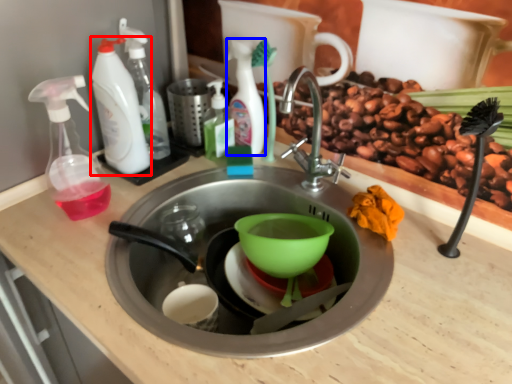
Question: Which object appears closest to the camera in this image, cleaning product (highlighted by a red box) or cleaning product (highlighted by a blue box)?

Choices:
 (A) cleaning product
 (B) cleaning product

Answer: (A)